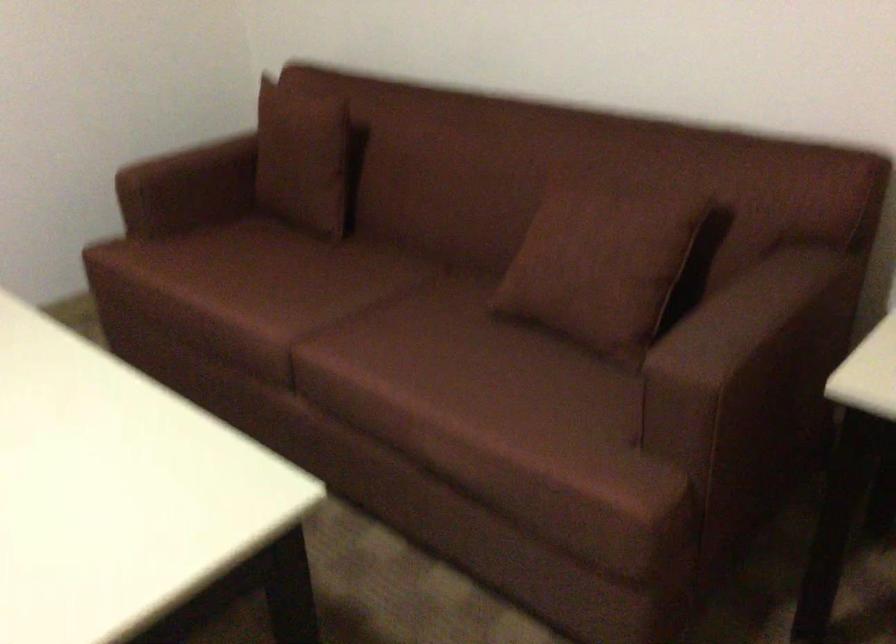
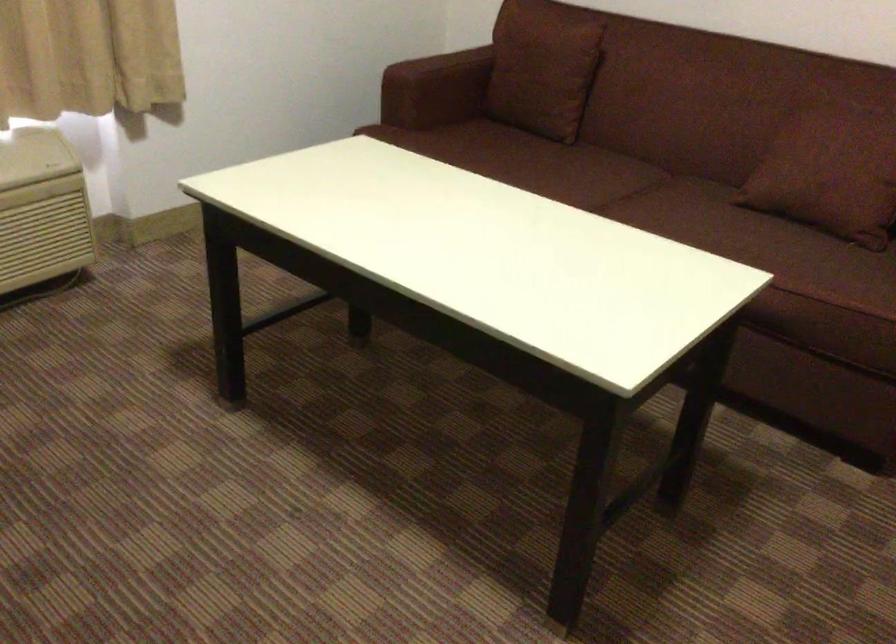
Find the pixel in the second image that matches (297,160) in the first image.

(543, 69)